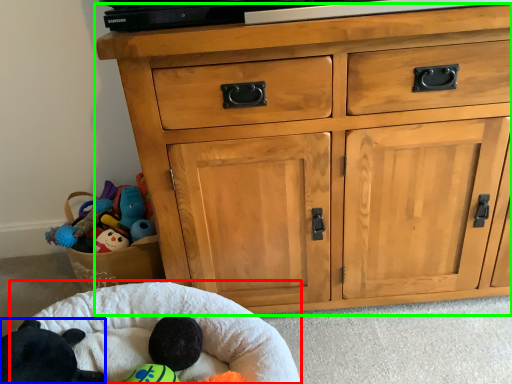
Question: Based on their relative distances, which object is nearer to infant bed (highlighted by a red box)? Choose from animal (highlighted by a blue box) and chest of drawers (highlighted by a green box).

Choices:
 (A) animal
 (B) chest of drawers

Answer: (A)